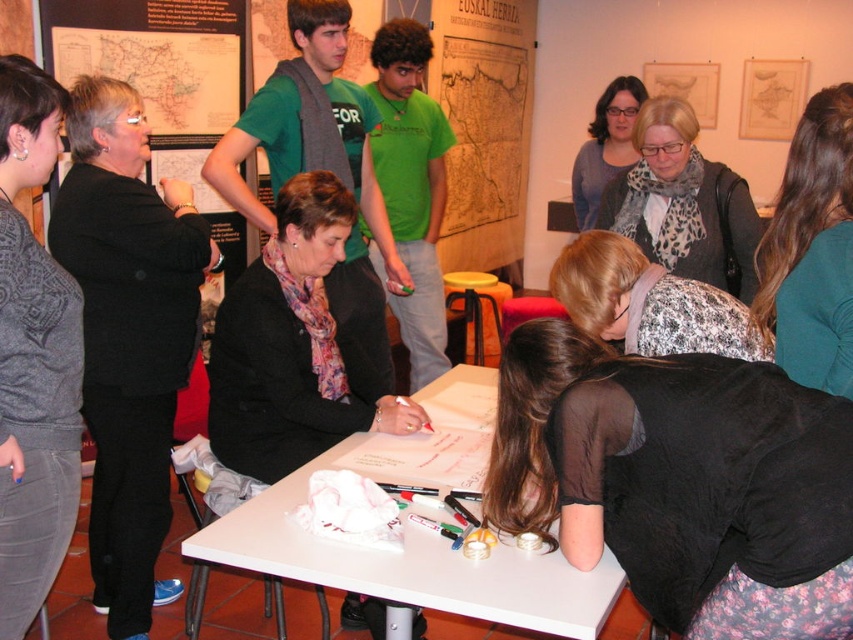
Question: Is black sheer blouse at lower right to the right of leopard print scarf at center from the viewer's perspective?

Choices:
 (A) no
 (B) yes

Answer: (A)

Question: Is gray textured sweater at left positioned before leopard print scarf at center?

Choices:
 (A) no
 (B) yes

Answer: (B)

Question: Which of the following is the closest to the observer?

Choices:
 (A) black matte jacket at upper left
 (B) patterned fabric scarf at center
 (C) leopard print scarf at center

Answer: (B)

Question: Which point appears closest to the camera in this image?

Choices:
 (A) (407, 634)
 (B) (351, 200)

Answer: (A)

Question: Among these objects, which one is farthest from the camera?

Choices:
 (A) matte gray sweater at center
 (B) teal sweater at lower right
 (C) black matte jacket at center
 (D) black matte jacket at upper left

Answer: (A)

Question: Does black matte jacket at upper left have a greater width compared to gray textured sweater at left?

Choices:
 (A) no
 (B) yes

Answer: (B)